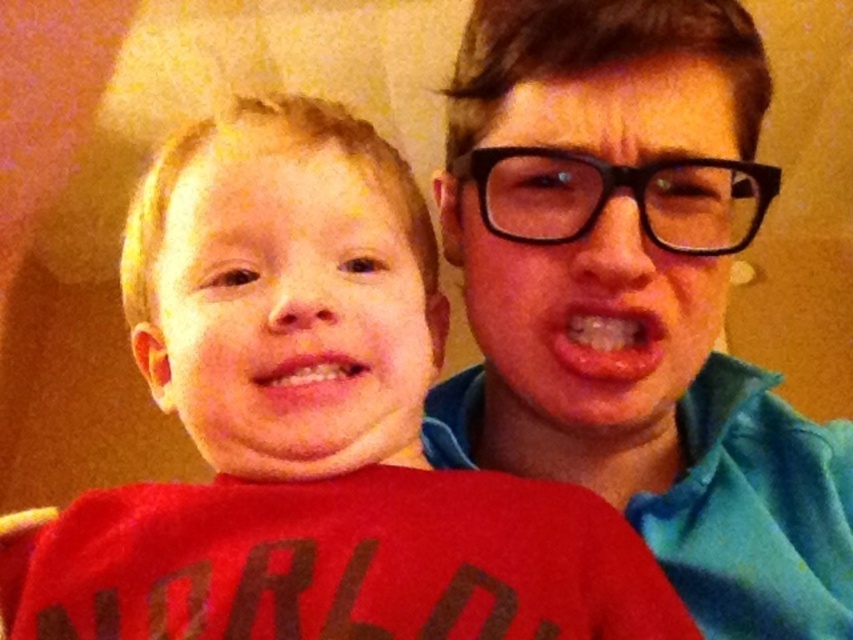
Question: Does blue fabric shirt at upper right appear on the right side of black plastic glasses at upper right?

Choices:
 (A) no
 (B) yes

Answer: (B)

Question: Which object is closer to the camera taking this photo?

Choices:
 (A) black plastic glasses at upper right
 (B) pink glossy lips at center
 (C) red matte shirt at left
 (D) smooth skin face at center

Answer: (C)

Question: Is blue fabric shirt at upper right positioned before smooth skin face at center?

Choices:
 (A) no
 (B) yes

Answer: (A)

Question: Estimate the real-world distances between objects in this image. Which object is farther from the red matte shirt at left?

Choices:
 (A) pink glossy lips at center
 (B) blue fabric shirt at upper right
 (C) smooth skin face at center

Answer: (B)

Question: Is blue fabric shirt at upper right to the right of glossy pink lips at center from the viewer's perspective?

Choices:
 (A) yes
 (B) no

Answer: (A)

Question: Which point is closer to the camera taking this photo?

Choices:
 (A) (556, 486)
 (B) (297, 401)
 (C) (671, 340)

Answer: (B)